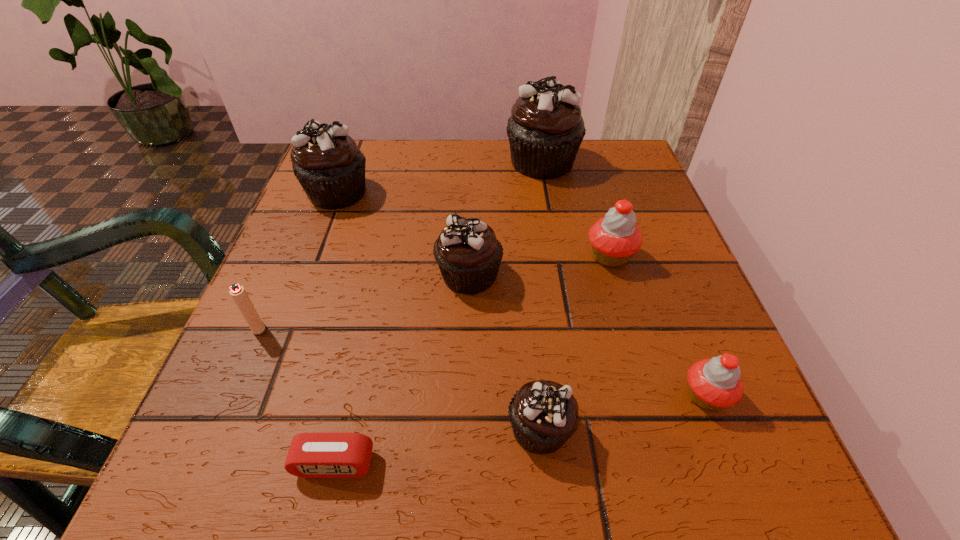
Find the location of a particular element. The width and height of the screenshot is (960, 540). the tallest cupcake is located at coordinates (545, 130).

You are a GUI agent. You are given a task and a screenshot of the screen. Output one action in this format:
    pyautogui.click(x=<x>, y=<y>)
    Task: Click on the tallest object
    The width and height of the screenshot is (960, 540).
    Given the screenshot: What is the action you would take?
    pyautogui.click(x=545, y=130)

Where is `the second tallest cupcake`? Image resolution: width=960 pixels, height=540 pixels. the second tallest cupcake is located at coordinates (330, 167).

The height and width of the screenshot is (540, 960). Identify the location of the second biggest brown cupcake. (330, 167).

At what (x,y) coordinates should I click in order to perform the action: click on the second smallest brown cupcake. Please return your answer as a coordinate pair (x, y). The image size is (960, 540). Looking at the image, I should click on (468, 254).

At what (x,y) coordinates should I click in order to perform the action: click on the farther red cupcake. Please return your answer as a coordinate pair (x, y). This screenshot has height=540, width=960. Looking at the image, I should click on (615, 238).

The width and height of the screenshot is (960, 540). Find the location of `igniter`. igniter is located at coordinates (237, 292).

This screenshot has height=540, width=960. In order to click on the fourth nearest object in this screenshot , I will do `click(237, 292)`.

Where is `the nearest brown cupcake`? This screenshot has height=540, width=960. the nearest brown cupcake is located at coordinates (543, 414).

Where is `the smaller red cupcake`? This screenshot has width=960, height=540. the smaller red cupcake is located at coordinates (714, 383).